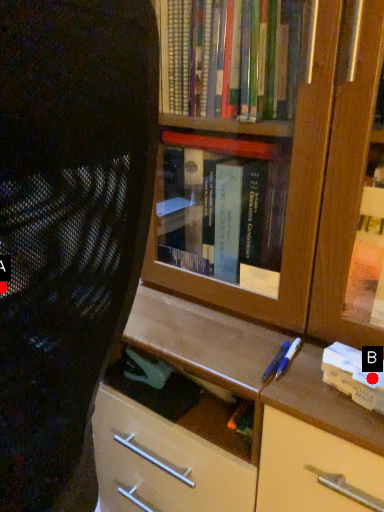
Question: Two points are circled on the image, labeled by A and B beside each circle. Which point is farther to the camera?

Choices:
 (A) A is further
 (B) B is further

Answer: (B)